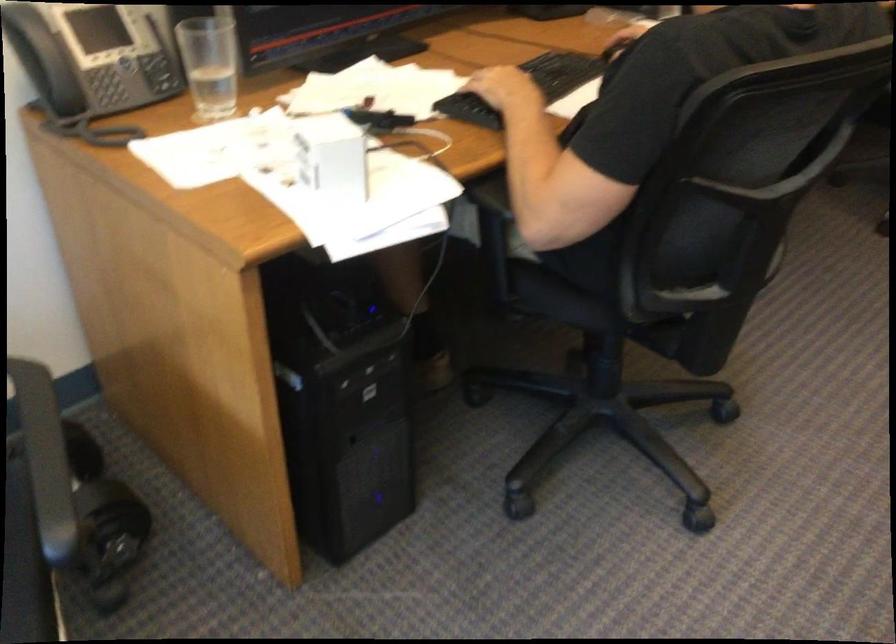
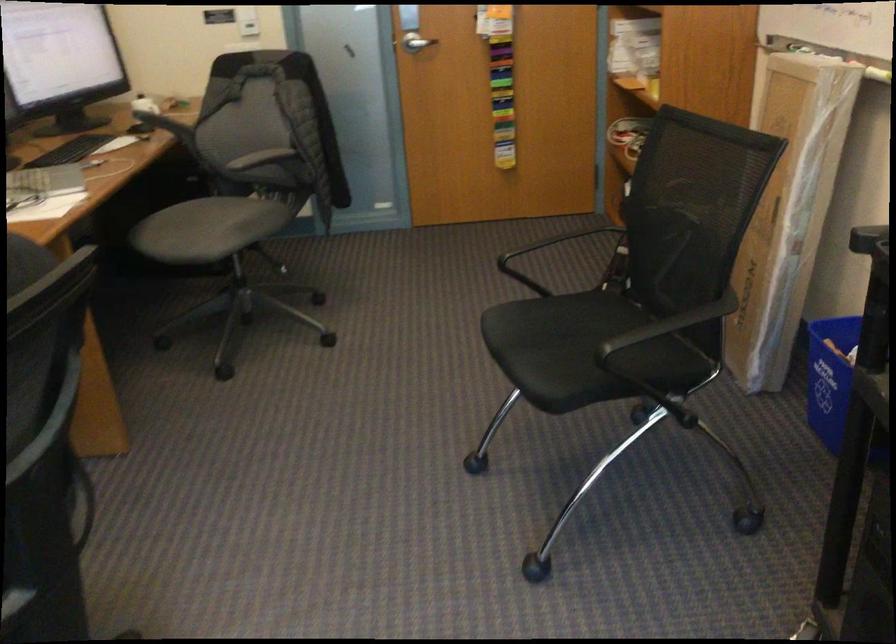
Question: Based on the continuous images, in which direction is the camera rotating? Reply with the corresponding letter.

Choices:
 (A) Left
 (B) Right
 (C) Up
 (D) Down

Answer: (B)